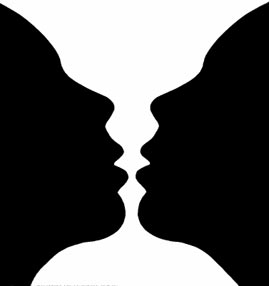
I want to click on cup, so click(135, 52).